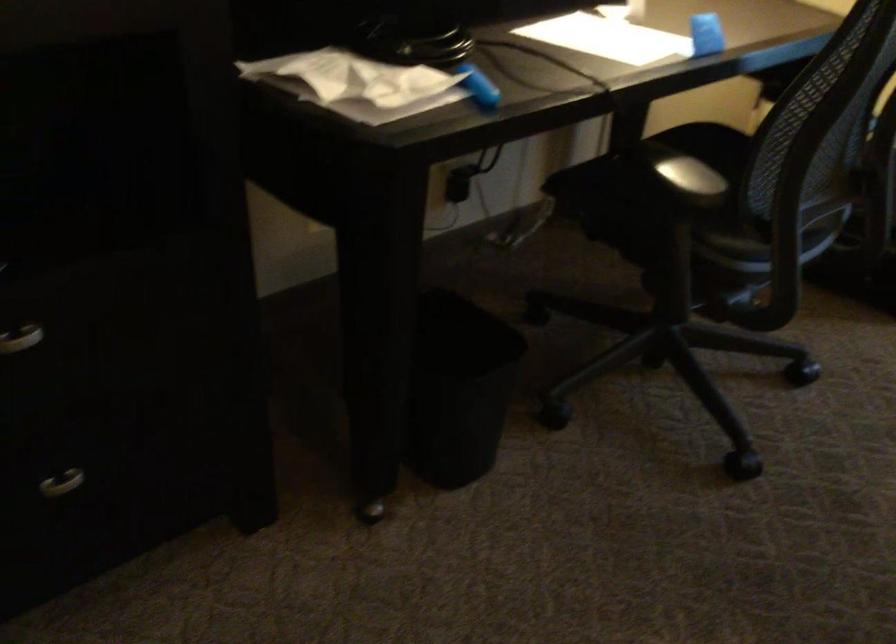
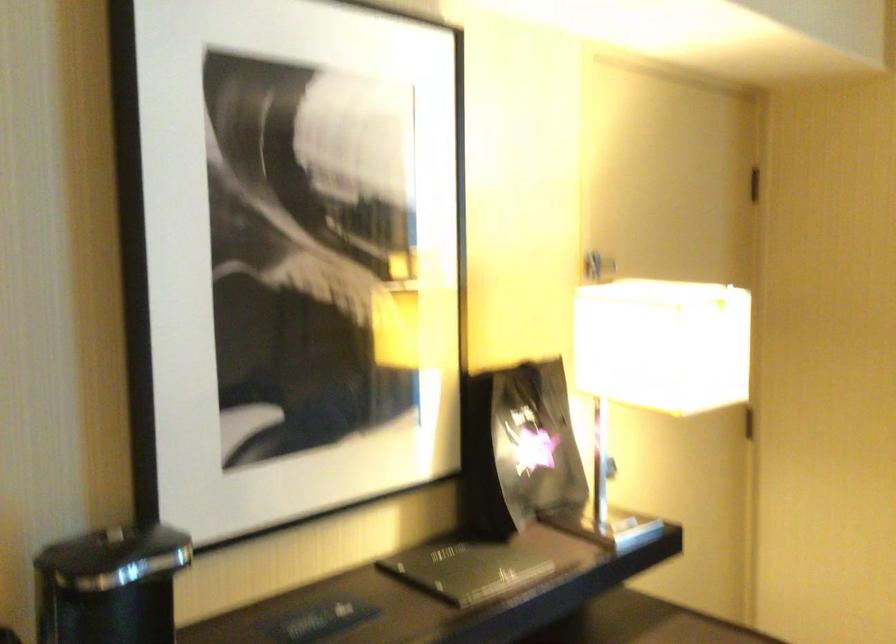
Question: The images are taken continuously from a first-person perspective. In which direction is your viewpoint rotating?

Choices:
 (A) Left
 (B) Right
 (C) Up
 (D) Down

Answer: (C)